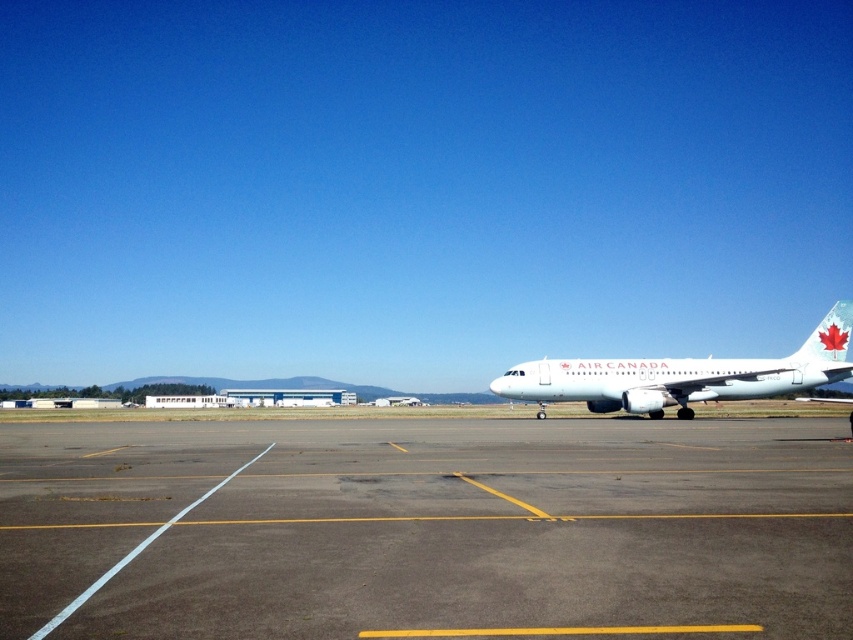
You are a pilot who needs to check the distance between the gray asphalt tarmac at center and the white glossy airplane at right. Which object is closer to the ground?

The gray asphalt tarmac at center is below the white glossy airplane at right, so the gray asphalt tarmac at center is closer to the ground.

Consider the image. You are standing on the airport tarmac and want to walk from point A to point B. Point A is at coordinates point (257, 480) and point B is at coordinates point (759, 388). Which point is closer to you when you start walking?

Point (257, 480) is closer to the viewer than point (759, 388), so you will start at the closer point A and walk towards point B.